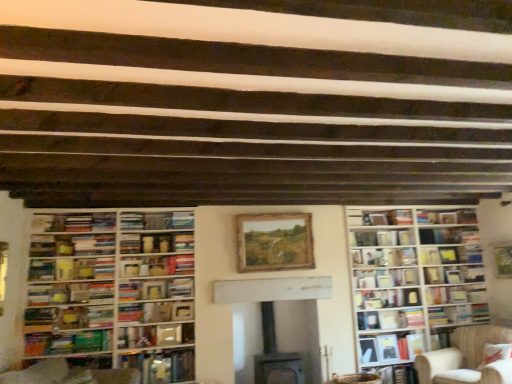
Question: Can you confirm if hardcover book at center, which is counted as the first book, starting from the top, is positioned to the left of hardcover book at center, which ranks as the sixth book in top-to-bottom order?

Choices:
 (A) yes
 (B) no

Answer: (A)

Question: Is hardcover book at center, which ranks as the sixth book in top-to-bottom order, at the back of hardcover book at center, which is counted as the first book, starting from the top?

Choices:
 (A) no
 (B) yes

Answer: (A)

Question: Considering the relative sizes of hardcover book at center, which is the 12th book in bottom-to-top order, and hardcover book at center, which ranks as the sixth book in top-to-bottom order, in the image provided, is hardcover book at center, which is the 12th book in bottom-to-top order, shorter than hardcover book at center, which ranks as the sixth book in top-to-bottom order,?

Choices:
 (A) no
 (B) yes

Answer: (B)

Question: From a real-world perspective, is hardcover book at center, which is the 12th book in bottom-to-top order, positioned under hardcover book at center, which is the 7th book in bottom-to-top order, based on gravity?

Choices:
 (A) no
 (B) yes

Answer: (A)

Question: Does hardcover book at center, which is the 12th book in bottom-to-top order, have a smaller size compared to hardcover book at center, which is the 7th book in bottom-to-top order?

Choices:
 (A) yes
 (B) no

Answer: (A)

Question: Does hardcover book at center, which is counted as the first book, starting from the top, come in front of hardcover book at center, which is the 7th book in bottom-to-top order?

Choices:
 (A) yes
 (B) no

Answer: (A)

Question: Does hardcover book at center, the 4th book in the top-to-bottom sequence, have a smaller size compared to beige fabric chair at lower right?

Choices:
 (A) no
 (B) yes

Answer: (B)

Question: Can you confirm if hardcover book at center, the 4th book in the top-to-bottom sequence, is positioned to the left of beige fabric chair at lower right?

Choices:
 (A) no
 (B) yes

Answer: (B)

Question: Is hardcover book at center, the 4th book in the top-to-bottom sequence, positioned behind beige fabric chair at lower right?

Choices:
 (A) yes
 (B) no

Answer: (A)

Question: From a real-world perspective, is hardcover book at center, the ninth book when ordered from bottom to top, on beige fabric chair at lower right?

Choices:
 (A) yes
 (B) no

Answer: (A)

Question: Can you confirm if hardcover book at center, the ninth book when ordered from bottom to top, is thinner than beige fabric chair at lower right?

Choices:
 (A) no
 (B) yes

Answer: (B)

Question: From the image's perspective, is hardcover book at center, the 4th book in the top-to-bottom sequence, above beige fabric chair at lower right?

Choices:
 (A) no
 (B) yes

Answer: (B)

Question: Does hardcover book at center, arranged as the eighth book when ordered from the bottom, have a lesser width compared to wooden bookshelf at left, which appears as the second bookcase when viewed from the right?

Choices:
 (A) no
 (B) yes

Answer: (B)